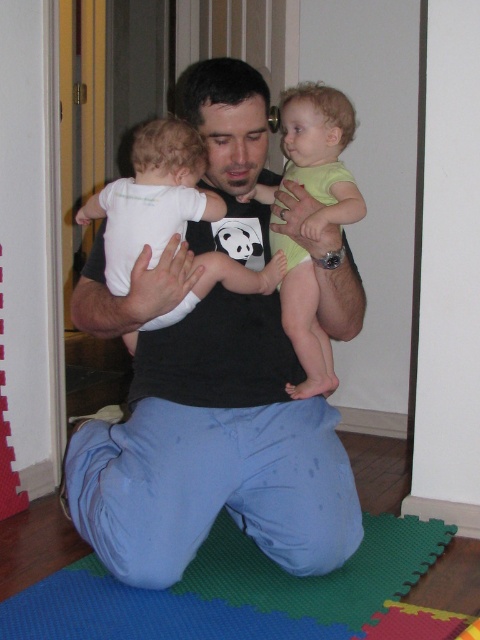
Question: Which point is closer to the camera?

Choices:
 (A) (192, 172)
 (B) (153, 509)

Answer: (A)

Question: Which point is farther to the camera?

Choices:
 (A) light green fabric toddler at center
 (B) white matte onesie at left
 (C) black cotton shirt at center

Answer: (A)

Question: Does black cotton shirt at center appear on the left side of green foam mat at lower center?

Choices:
 (A) no
 (B) yes

Answer: (B)

Question: Is black cotton shirt at center closer to camera compared to green foam mat at lower center?

Choices:
 (A) no
 (B) yes

Answer: (A)

Question: Which object is the farthest from the green foam mat at lower center?

Choices:
 (A) black cotton shirt at center
 (B) white matte onesie at left
 (C) light green fabric toddler at center

Answer: (B)

Question: Where is black cotton shirt at center located in relation to light green fabric toddler at center in the image?

Choices:
 (A) right
 (B) left

Answer: (B)